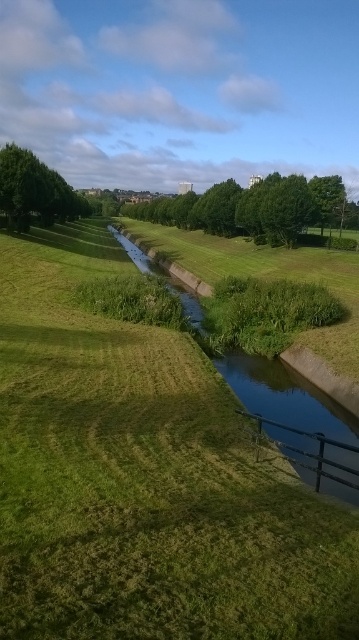
Can you confirm if green grassy at center is positioned to the left of green leafy tree at upper left?

In fact, green grassy at center is to the right of green leafy tree at upper left.

Who is more forward, [301,577] or [66,192]?

Point [301,577] is in front.

At what (x,y) coordinates should I click in order to perform the action: click on green grassy at center. Please return your answer as a coordinate pair (x, y). Looking at the image, I should click on (143, 477).

Is green grassy stream at center further to the viewer compared to green leafy tree at center?

No.

Does green grassy stream at center have a smaller size compared to green leafy tree at center?

Indeed, green grassy stream at center has a smaller size compared to green leafy tree at center.

Is point (254, 401) more distant than point (260, 196)?

No, it is not.

Find the location of a particular element. green grassy stream at center is located at coordinates (286, 404).

Is green leafy tree at center above green leafy tree at upper left?

Yes.

In the scene shown: Is green leafy tree at center taller than green leafy tree at upper left?

Yes, green leafy tree at center is taller than green leafy tree at upper left.

What do you see at coordinates (254, 209) in the screenshot? I see `green leafy tree at center` at bounding box center [254, 209].

The image size is (359, 640). In order to click on green leafy tree at center in this screenshot , I will do `click(254, 209)`.